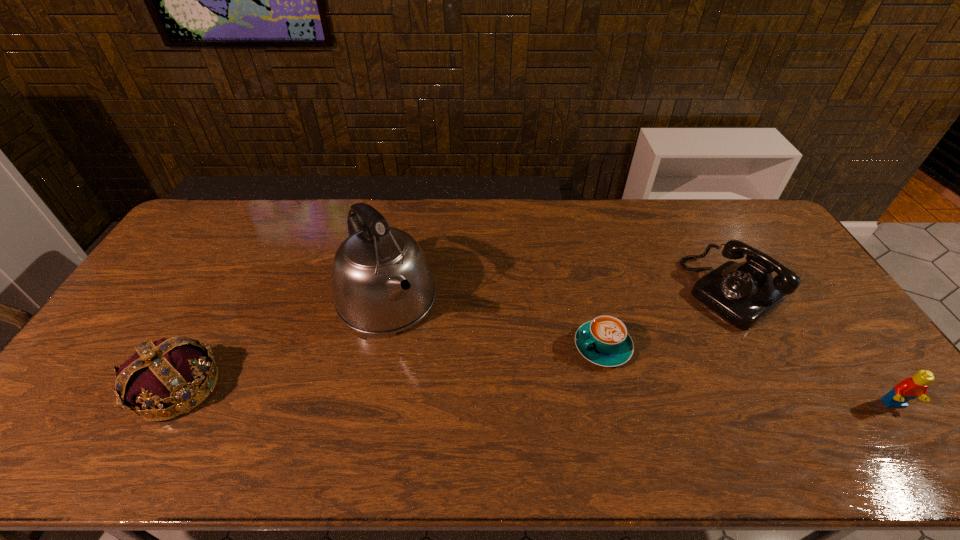
Locate an element on the screen. The image size is (960, 540). object that ranks as the closest to the second object from right to left is located at coordinates tap(910, 388).

Where is `free spot that satisfies the following two spatial constraints: 1. on the front side of the cappuccino; 2. on the left side of the tallest object`? The image size is (960, 540). free spot that satisfies the following two spatial constraints: 1. on the front side of the cappuccino; 2. on the left side of the tallest object is located at coordinates (377, 347).

This screenshot has height=540, width=960. Identify the location of free space that satisfies the following two spatial constraints: 1. on the back side of the second object from right to left; 2. on the right side of the kettle. (388, 291).